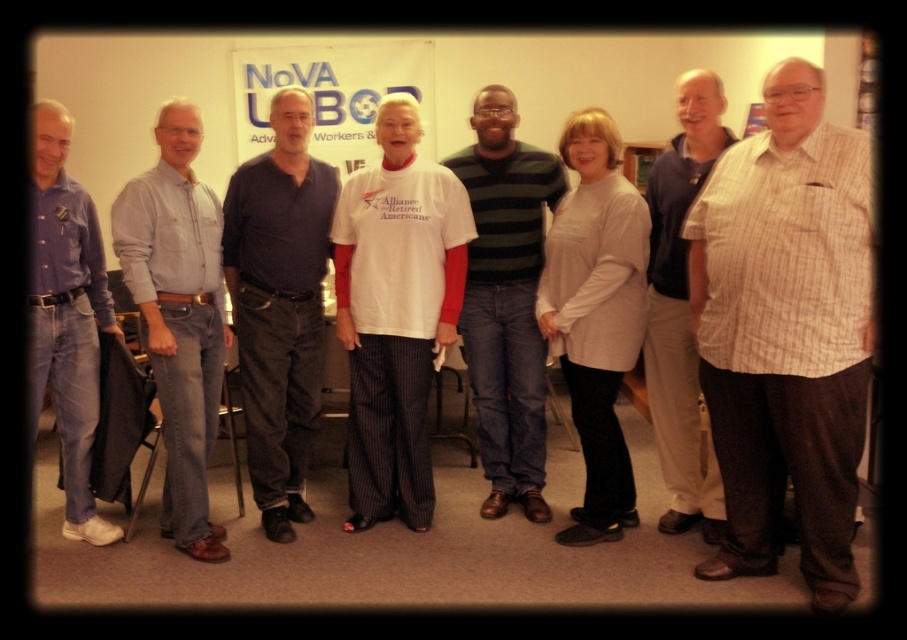
Question: Which of the following is the farthest from the observer?

Choices:
 (A) matte blue shirt at left
 (B) white cotton shirt at center

Answer: (B)

Question: Which point is closer to the camera?

Choices:
 (A) (813, 598)
 (B) (449, 300)

Answer: (A)

Question: Is white striped shirt at right to the right of white cotton shirt at center from the viewer's perspective?

Choices:
 (A) yes
 (B) no

Answer: (A)

Question: Is dark blue shirt at center positioned before matte blue shirt at left?

Choices:
 (A) yes
 (B) no

Answer: (B)

Question: Among these points, which one is nearest to the camera?

Choices:
 (A) (479, 237)
 (B) (646, 241)

Answer: (B)

Question: Is white soft sweater at center to the right of green striped sweater at center from the viewer's perspective?

Choices:
 (A) no
 (B) yes

Answer: (B)